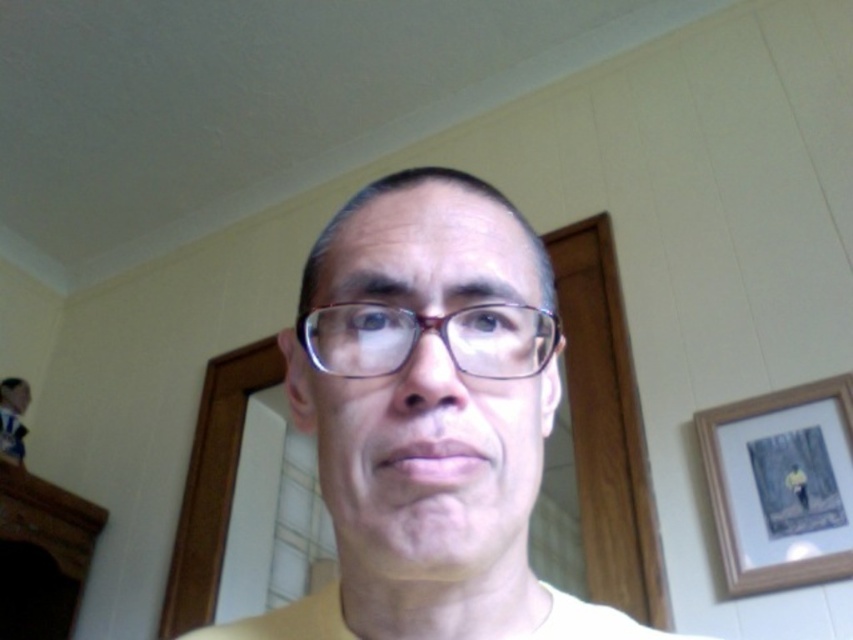
Can you confirm if wooden framed artwork at right is thinner than matte purple glasses at center?

In fact, wooden framed artwork at right might be wider than matte purple glasses at center.

Is wooden framed artwork at right wider than matte purple glasses at center?

Correct, the width of wooden framed artwork at right exceeds that of matte purple glasses at center.

Does point (842, 541) come closer to viewer compared to point (480, 362)?

No, (842, 541) is further to viewer.

Where is `wooden framed artwork at right`? This screenshot has height=640, width=853. wooden framed artwork at right is located at coordinates (779, 484).

Locate an element on the screen. The image size is (853, 640). wooden framed artwork at right is located at coordinates (779, 484).

Does point (764, 548) come closer to viewer compared to point (625, 637)?

No, it is not.

I want to click on wooden framed artwork at right, so click(779, 484).

Which is more to the right, matte yellow shirt at center or wooden framed artwork at right?

Positioned to the right is wooden framed artwork at right.

Is matte yellow shirt at center shorter than wooden framed artwork at right?

No, matte yellow shirt at center is not shorter than wooden framed artwork at right.

Does point (235, 625) come behind point (740, 433)?

That is False.

Identify the location of matte yellow shirt at center. (434, 401).